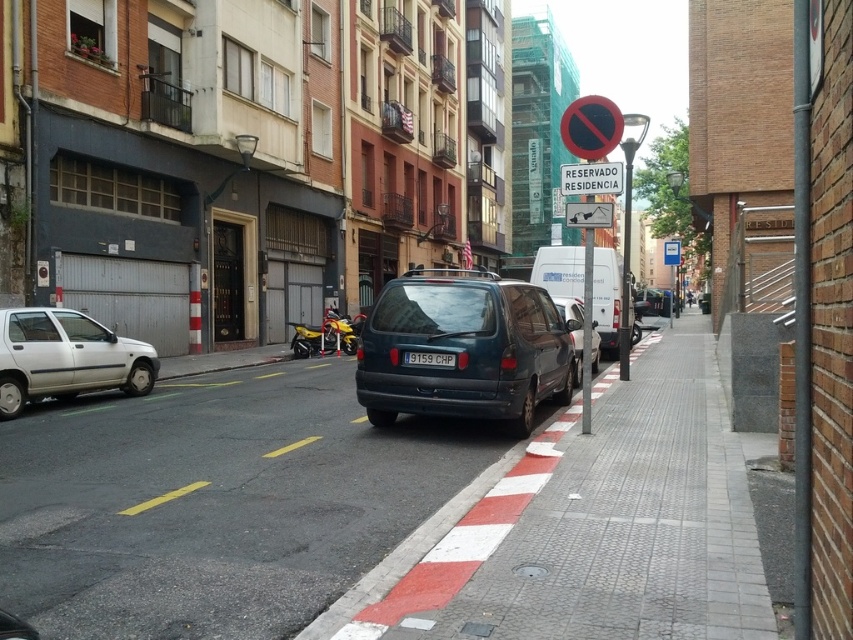
The image size is (853, 640). What do you see at coordinates (463, 349) in the screenshot? I see `dark blue matte minivan at center` at bounding box center [463, 349].

From the picture: Does dark blue matte minivan at center have a larger size compared to black plastic license plate at center?

Indeed, dark blue matte minivan at center has a larger size compared to black plastic license plate at center.

What do you see at coordinates (463, 349) in the screenshot?
I see `dark blue matte minivan at center` at bounding box center [463, 349].

At what (x,y) coordinates should I click in order to perform the action: click on dark blue matte minivan at center. Please return your answer as a coordinate pair (x, y). Looking at the image, I should click on (463, 349).

How distant is dark blue matte minivan at center from silver metallic hatchback at left?

dark blue matte minivan at center and silver metallic hatchback at left are 5.73 meters apart from each other.

How distant is dark blue matte minivan at center from silver metallic hatchback at left?

dark blue matte minivan at center is 5.73 meters from silver metallic hatchback at left.

Locate an element on the screen. dark blue matte minivan at center is located at coordinates (463, 349).

Who is shorter, white matte van at center or black plastic license plate at center?

black plastic license plate at center

Who is lower down, white matte van at center or black plastic license plate at center?

Positioned lower is black plastic license plate at center.

Which is behind, point (578, 268) or point (433, 356)?

Positioned behind is point (578, 268).

Find the location of a particular element. The image size is (853, 640). white matte van at center is located at coordinates (607, 298).